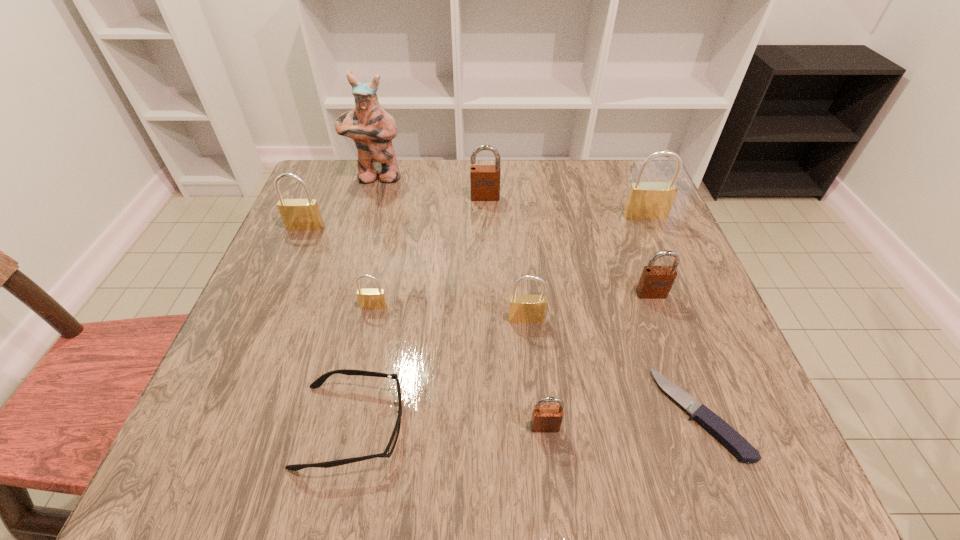
Locate which brown padlock is the second closest to the second farthest brass padlock. Please provide its 2D coordinates. Your answer should be formatted as a tuple, i.e. [(x, y)], where the tuple contains the x and y coordinates of a point satisfying the conditions above.

[(545, 418)]

I want to click on brown padlock that can be found as the closest to the rightmost brown padlock, so click(x=545, y=418).

The height and width of the screenshot is (540, 960). I want to click on vacant area that satisfies the following two spatial constraints: 1. on the front-facing side of the fifth farthest object; 2. on the front-facing side of the ninth tallest object, so click(x=699, y=426).